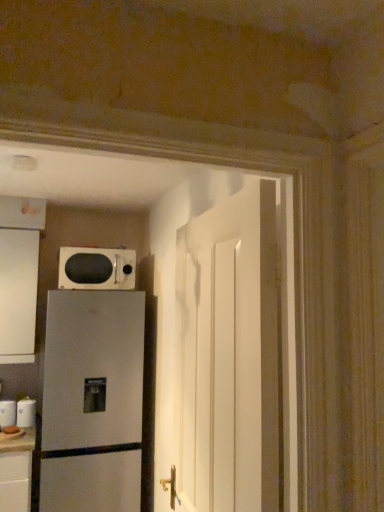
Question: Considering the positions of white matte cabinet at left and white glossy microwave at upper center in the image, is white matte cabinet at left wider or thinner than white glossy microwave at upper center?

Choices:
 (A) thin
 (B) wide

Answer: (B)

Question: Considering the positions of white matte cabinet at left and white glossy microwave at upper center in the image, is white matte cabinet at left taller or shorter than white glossy microwave at upper center?

Choices:
 (A) tall
 (B) short

Answer: (A)

Question: Considering the real-world distances, which object is closest to the white glossy mug at lower left, which is the 1th appliance from left to right?

Choices:
 (A) white matte cabinet at left
 (B) white glossy paper towel dispenser at lower left, which is the first appliance in right-to-left order
 (C) white glossy microwave at upper center
 (D) white glossy door at center
 (E) satin silver refrigerator at lower left

Answer: (B)

Question: Which object is positioned closest to the white glossy mug at lower left, which is counted as the second appliance, starting from the right?

Choices:
 (A) white glossy door at center
 (B) satin silver refrigerator at lower left
 (C) white glossy paper towel dispenser at lower left, which is the first appliance in right-to-left order
 (D) white glossy microwave at upper center
 (E) white matte cabinet at left

Answer: (C)